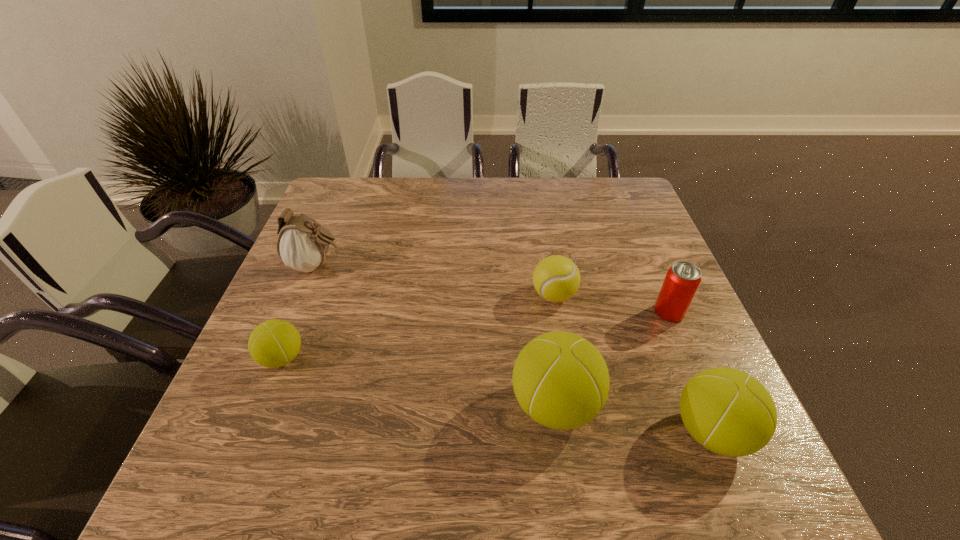
Where is `vacant position for inserting another tennis_ball evenly`? The height and width of the screenshot is (540, 960). vacant position for inserting another tennis_ball evenly is located at coordinates (413, 380).